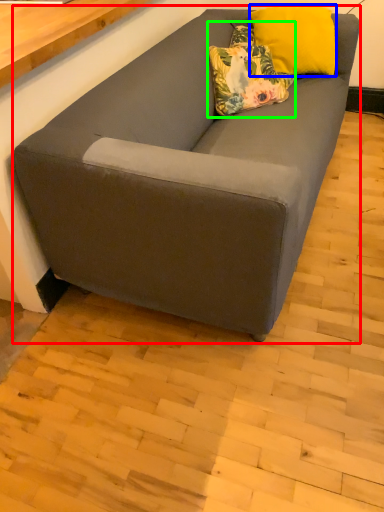
Question: Estimate the real-world distances between objects in this image. Which object is closer to studio couch (highlighted by a red box), pillow (highlighted by a blue box) or pillow (highlighted by a green box)?

Choices:
 (A) pillow
 (B) pillow

Answer: (B)